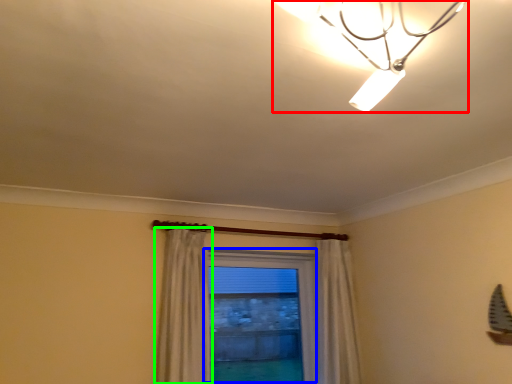
Question: Which is farther away from lamp (highlighted by a red box)? window (highlighted by a blue box) or curtain (highlighted by a green box)?

Choices:
 (A) window
 (B) curtain

Answer: (A)